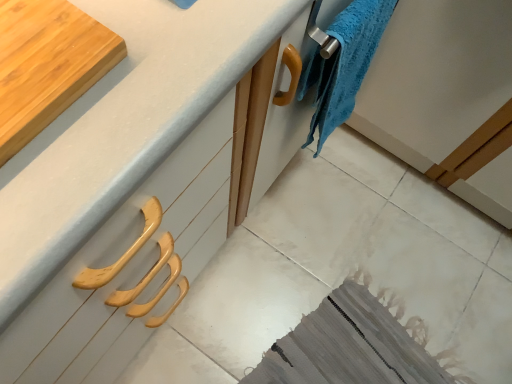
Question: Considering the positions of white matte countertop at upper left and wooden cutting board at upper left in the image, is white matte countertop at upper left wider or thinner than wooden cutting board at upper left?

Choices:
 (A) wide
 (B) thin

Answer: (A)

Question: From the image's perspective, is white matte countertop at upper left above or below wooden cutting board at upper left?

Choices:
 (A) above
 (B) below

Answer: (A)

Question: Which is farther from the white matte countertop at upper left?

Choices:
 (A) blue fuzzy towel at upper right
 (B) wooden cutting board at upper left

Answer: (A)

Question: Which object is the farthest from the wooden cutting board at upper left?

Choices:
 (A) white matte countertop at upper left
 (B) blue fuzzy towel at upper right

Answer: (B)